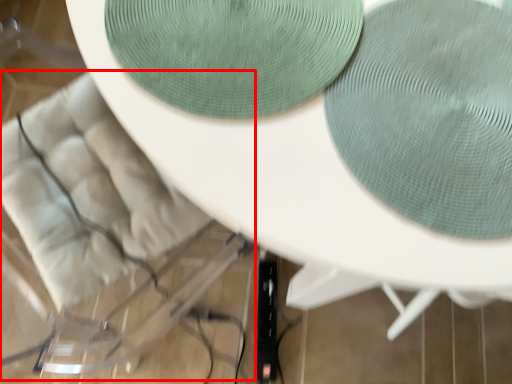
Question: Considering the relative positions of swivel chair (annotated by the red box) and oval in the image provided, where is swivel chair (annotated by the red box) located with respect to the staircase?

Choices:
 (A) left
 (B) right

Answer: (A)